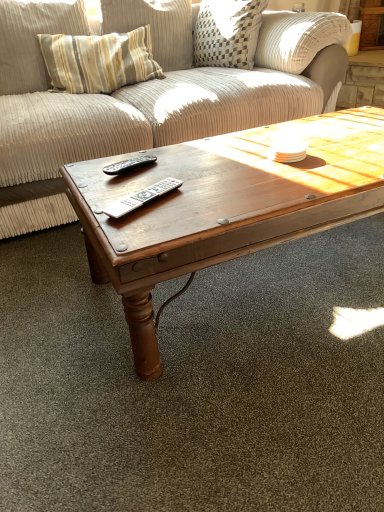
Question: Can you confirm if silver metallic remote at center, marked as the second remote in a top-to-bottom arrangement, is taller than wooden coffee table at center?

Choices:
 (A) yes
 (B) no

Answer: (B)

Question: Does silver metallic remote at center, marked as the second remote in a top-to-bottom arrangement, appear on the right side of wooden coffee table at center?

Choices:
 (A) yes
 (B) no

Answer: (B)

Question: Does silver metallic remote at center, placed as the first remote when sorted from front to back, come behind wooden coffee table at center?

Choices:
 (A) yes
 (B) no

Answer: (A)

Question: Are silver metallic remote at center, the first remote positioned from the bottom, and wooden coffee table at center far apart?

Choices:
 (A) no
 (B) yes

Answer: (A)

Question: Is silver metallic remote at center, the first remote positioned from the bottom, shorter than wooden coffee table at center?

Choices:
 (A) yes
 (B) no

Answer: (A)

Question: From the image's perspective, would you say silver metallic remote at center, marked as the second remote in a top-to-bottom arrangement, is shown under wooden coffee table at center?

Choices:
 (A) no
 (B) yes

Answer: (B)

Question: Can you confirm if wooden coffee table at center is positioned to the right of silver metallic remote at center, placed as the first remote when sorted from front to back?

Choices:
 (A) yes
 (B) no

Answer: (A)

Question: Is wooden coffee table at center positioned beyond the bounds of silver metallic remote at center, placed as the first remote when sorted from front to back?

Choices:
 (A) yes
 (B) no

Answer: (A)

Question: Does wooden coffee table at center appear on the left side of silver metallic remote at center, marked as the second remote in a top-to-bottom arrangement?

Choices:
 (A) yes
 (B) no

Answer: (B)

Question: From a real-world perspective, does wooden coffee table at center sit lower than silver metallic remote at center, the first remote positioned from the bottom?

Choices:
 (A) yes
 (B) no

Answer: (A)

Question: Could you tell me if wooden coffee table at center is turned towards silver metallic remote at center, marked as the second remote in a top-to-bottom arrangement?

Choices:
 (A) yes
 (B) no

Answer: (B)

Question: Is wooden coffee table at center wider than silver metallic remote at center, which ranks as the 2th remote in back-to-front order?

Choices:
 (A) no
 (B) yes

Answer: (B)

Question: Does striped fabric pillow at upper left have a larger size compared to silver metallic remote at center, which ranks as the 2th remote in back-to-front order?

Choices:
 (A) yes
 (B) no

Answer: (A)